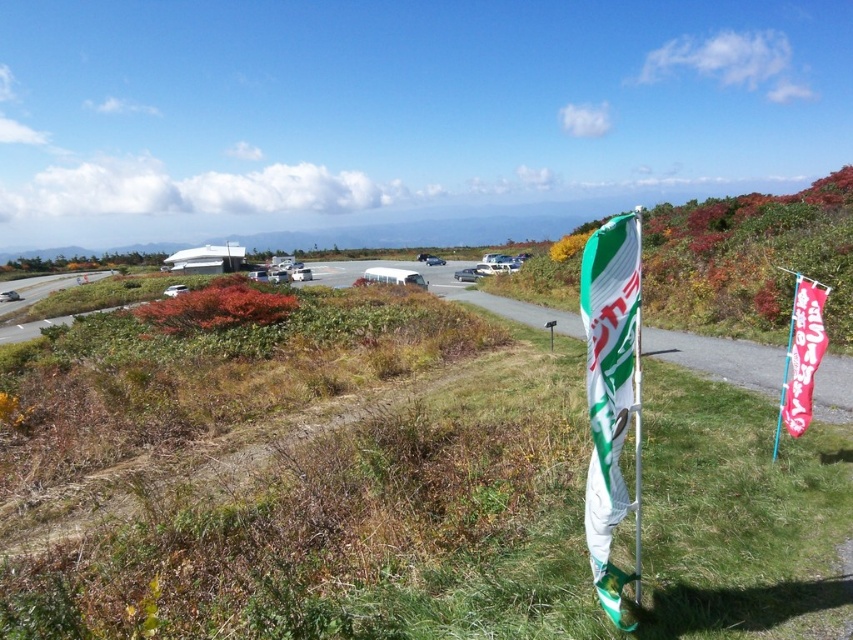
You are standing at the point with coordinates point (785,364) and want to walk to the point with coordinates point (636,506). Which direction should you walk relative to your current position?

You should walk forward because point (636,506) is in front of point (785,364).

You are a tourist standing in front of the two flags and want to take a photo that includes both the white fabric flag at right and the red fabric flag at right. To ensure both flags are in the frame, should you position yourself to the left or right of the flags?

You should position yourself to the left of the white fabric flag at right and red fabric flag at right. Since the white fabric flag at right is on the left side of the red fabric flag at right, standing to the left allows you to capture both in the frame without one blocking the other.